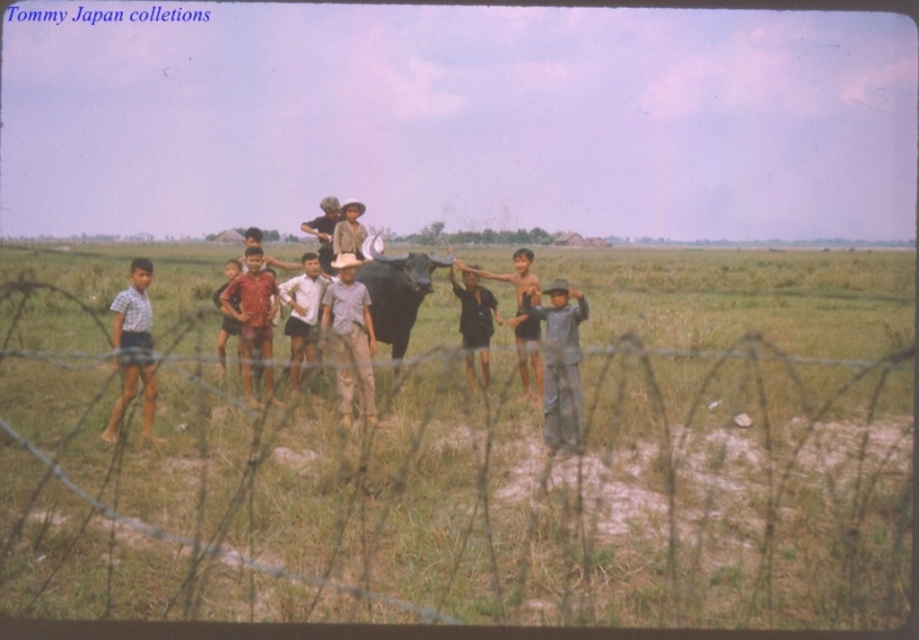
Between point (531, 497) and point (271, 348), which one is positioned behind?

Positioned behind is point (271, 348).

The height and width of the screenshot is (640, 919). I want to click on barbed wire at center, so click(x=468, y=458).

Find the location of a particular element. The image size is (919, 640). barbed wire at center is located at coordinates (468, 458).

Which is more to the right, shiny black bull at center or light brown skin at center?

From the viewer's perspective, shiny black bull at center appears more on the right side.

Which of these two, shiny black bull at center or light brown skin at center, stands shorter?

light brown skin at center is shorter.

At what (x,y) coordinates should I click in order to perform the action: click on shiny black bull at center. Please return your answer as a coordinate pair (x, y). This screenshot has height=640, width=919. Looking at the image, I should click on (396, 294).

Is barbed wire at center to the right of shiny black bull at center from the viewer's perspective?

In fact, barbed wire at center is to the left of shiny black bull at center.

Is point (874, 333) positioned in front of point (401, 340)?

That is False.

At what (x,y) coordinates should I click in order to perform the action: click on barbed wire at center. Please return your answer as a coordinate pair (x, y). The image size is (919, 640). Looking at the image, I should click on (468, 458).